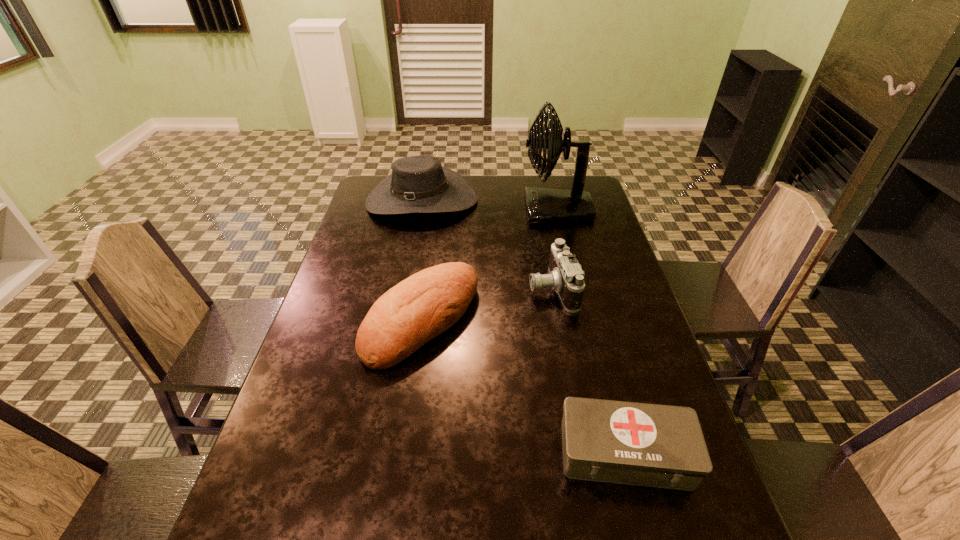
The height and width of the screenshot is (540, 960). Find the location of `the first-aid kit located at the right edge`. the first-aid kit located at the right edge is located at coordinates (663, 446).

This screenshot has height=540, width=960. Find the location of `object located in the far left corner section of the desktop`. object located in the far left corner section of the desktop is located at coordinates (418, 184).

Find the location of `object situated at the far right corner`. object situated at the far right corner is located at coordinates (544, 206).

Locate an element on the screen. The height and width of the screenshot is (540, 960). vacant point at the far edge is located at coordinates (521, 179).

I want to click on vacant area at the left edge, so click(264, 500).

What are the coordinates of `vacant space at the right edge of the desktop` in the screenshot? It's located at (597, 240).

Identify the location of unoccupied position between the fourth shortest object and the tallest object. (489, 205).

Image resolution: width=960 pixels, height=540 pixels. In order to click on empty location between the fourth shortest object and the fan in this screenshot , I will do `click(489, 205)`.

Where is `vacant point located between the tallest object and the bread`? This screenshot has height=540, width=960. vacant point located between the tallest object and the bread is located at coordinates (489, 265).

Locate an element on the screen. The height and width of the screenshot is (540, 960). free spot between the fan and the cowboy hat is located at coordinates (489, 205).